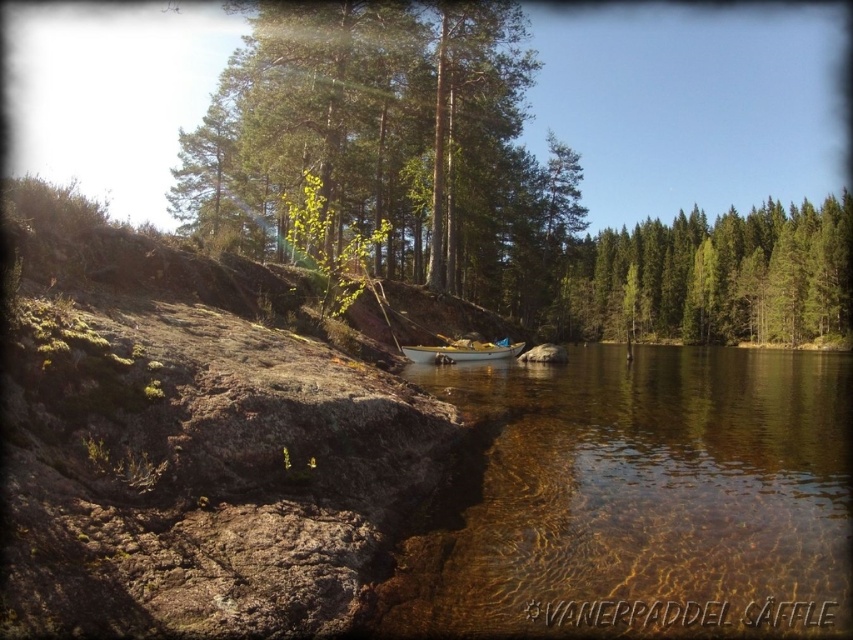
Question: Which of these objects is positioned closest to the white plastic canoe at center?

Choices:
 (A) clear water at center
 (B) green leafy tree at upper center

Answer: (A)

Question: Is clear water at center bigger than green matte tree at center?

Choices:
 (A) yes
 (B) no

Answer: (B)

Question: Which object is positioned closest to the green leafy tree at upper center?

Choices:
 (A) white plastic canoe at center
 (B) clear water at center

Answer: (A)

Question: Is the position of clear water at center more distant than that of green leafy tree at upper center?

Choices:
 (A) no
 (B) yes

Answer: (A)

Question: Considering the relative positions of green leafy tree at upper center and white plastic canoe at center in the image provided, where is green leafy tree at upper center located with respect to white plastic canoe at center?

Choices:
 (A) below
 (B) above

Answer: (B)

Question: Estimate the real-world distances between objects in this image. Which object is closer to the white plastic canoe at center?

Choices:
 (A) clear water at center
 (B) green leafy tree at upper center

Answer: (A)